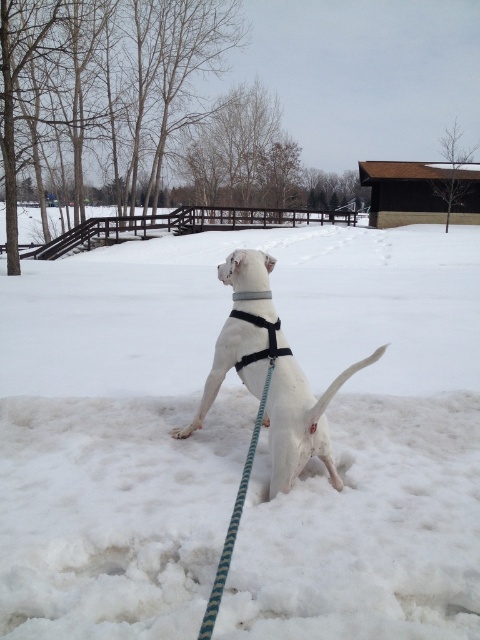
Is point (407, 356) in front of point (240, 296)?

No.

This screenshot has width=480, height=640. What are the coordinates of `white fluffy snow at center` in the screenshot? It's located at (240, 442).

Who is shorter, green striped leash at center or gray fabric neckband at upper center?

gray fabric neckband at upper center

The image size is (480, 640). What are the coordinates of `green striped leash at center` in the screenshot? It's located at (235, 515).

Is the position of white matte harness at center less distant than that of gray fabric neckband at upper center?

Yes, it is.

Does point (286, 476) come in front of point (264, 296)?

Yes, it is.

Between point (242, 285) and point (264, 296), which one is positioned behind?

Point (242, 285)

Where is `white matte harness at center`? This screenshot has width=480, height=640. white matte harness at center is located at coordinates (274, 392).